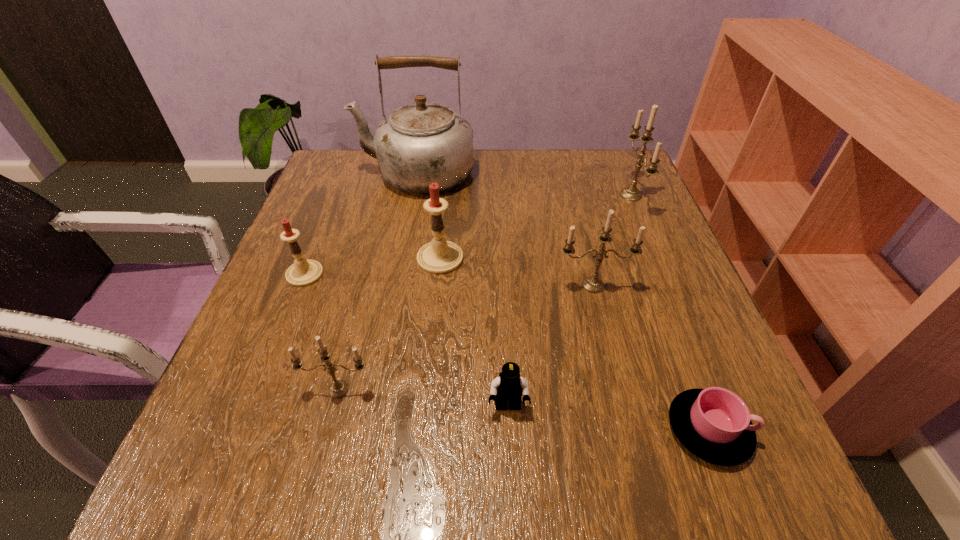
The height and width of the screenshot is (540, 960). I want to click on vacant space that satisfies the following two spatial constraints: 1. on the front side of the third candle from left to right; 2. on the right side of the second smallest metallic candle, so click(x=438, y=285).